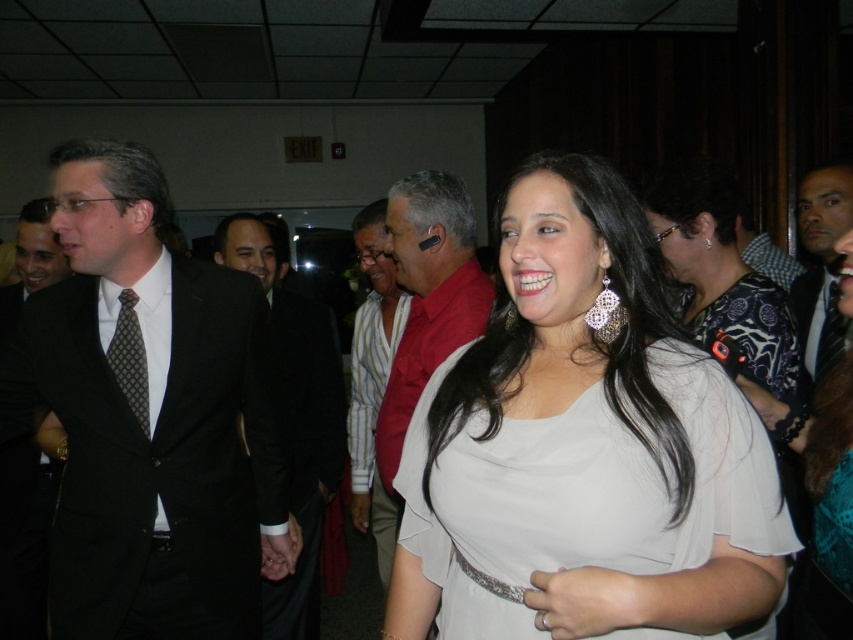
Question: Which object is positioned closest to the black matte earbud at center?

Choices:
 (A) light beige fabric dress at center
 (B) dark gray textured tie at left
 (C) black suit at center

Answer: (C)

Question: Is light beige fabric dress at center below black suit at center?

Choices:
 (A) yes
 (B) no

Answer: (B)

Question: Which object is farther from the camera taking this photo?

Choices:
 (A) black suit at left
 (B) black matte earbud at center
 (C) black suit at center

Answer: (C)

Question: Is black suit at center to the left of dark gray suit at right from the viewer's perspective?

Choices:
 (A) yes
 (B) no

Answer: (A)

Question: Considering the real-world distances, which object is farthest from the matte black suit at left?

Choices:
 (A) light beige fabric dress at center
 (B) dark gray textured tie at left
 (C) black matte earbud at center

Answer: (A)

Question: Can you confirm if light beige fabric dress at center is bigger than black matte earbud at center?

Choices:
 (A) no
 (B) yes

Answer: (A)